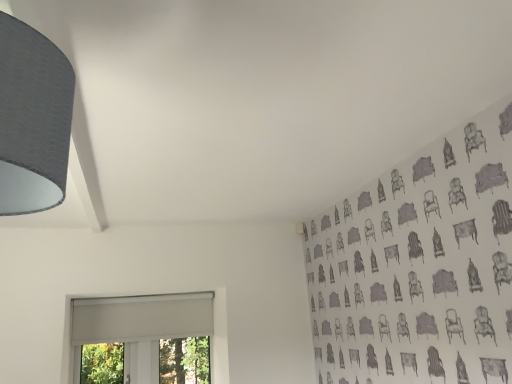
What do you see at coordinates (139, 325) in the screenshot? I see `white matte window at lower left` at bounding box center [139, 325].

You are a GUI agent. You are given a task and a screenshot of the screen. Output one action in this format:
    pyautogui.click(x=<x>, y=<y>)
    Task: Click on the white matte window at lower left
    
    Given the screenshot: What is the action you would take?
    pyautogui.click(x=139, y=325)

Measure the distance between white matte window at lower left and camera.

They are 2.87 meters apart.

This screenshot has width=512, height=384. I want to click on matte gray lampshade at upper left, so click(33, 119).

The height and width of the screenshot is (384, 512). What do you see at coordinates (33, 119) in the screenshot?
I see `matte gray lampshade at upper left` at bounding box center [33, 119].

Locate an element on the screen. The width and height of the screenshot is (512, 384). white matte window at lower left is located at coordinates (139, 325).

Is white matte window at lower left to the right of matte gray lampshade at upper left from the viewer's perspective?

In fact, white matte window at lower left is to the left of matte gray lampshade at upper left.

In the scene shown: Is white matte window at lower left positioned in front of matte gray lampshade at upper left?

No, it is not.

Between point (151, 374) and point (36, 136), which one is positioned behind?

The point (151, 374) is behind.

Looking at this image, from the image's perspective, which one is positioned lower, white matte window at lower left or matte gray lampshade at upper left?

From the image's view, white matte window at lower left is below.

From a real-world perspective, is white matte window at lower left located beneath matte gray lampshade at upper left?

Yes, from a real-world perspective, white matte window at lower left is below matte gray lampshade at upper left.

Does white matte window at lower left have a lesser width compared to matte gray lampshade at upper left?

Yes, white matte window at lower left is thinner than matte gray lampshade at upper left.

Considering the sizes of objects white matte window at lower left and matte gray lampshade at upper left in the image provided, who is shorter, white matte window at lower left or matte gray lampshade at upper left?

matte gray lampshade at upper left is shorter.

Considering the relative sizes of white matte window at lower left and matte gray lampshade at upper left in the image provided, is white matte window at lower left smaller than matte gray lampshade at upper left?

Actually, white matte window at lower left might be larger than matte gray lampshade at upper left.

Is white matte window at lower left situated inside matte gray lampshade at upper left or outside?

white matte window at lower left exists outside the volume of matte gray lampshade at upper left.

Are white matte window at lower left and matte gray lampshade at upper left far apart?

Yes.

Is white matte window at lower left looking in the opposite direction of matte gray lampshade at upper left?

white matte window at lower left does not have its back to matte gray lampshade at upper left.

In the scene shown: What's the angular difference between white matte window at lower left and matte gray lampshade at upper left's facing directions?

2.21 degrees.

What are the coordinates of `lamp in front of the white matte window at lower left` in the screenshot? It's located at (33, 119).

Which object is positioned more to the left, matte gray lampshade at upper left or white matte window at lower left?

From the viewer's perspective, white matte window at lower left appears more on the left side.

Relative to white matte window at lower left, is matte gray lampshade at upper left in front or behind?

Visually, matte gray lampshade at upper left is located in front of white matte window at lower left.

Considering the points (3, 174) and (191, 332), which point is behind, point (3, 174) or point (191, 332)?

Positioned behind is point (191, 332).

From the image's perspective, who appears lower, matte gray lampshade at upper left or white matte window at lower left?

From the image's view, white matte window at lower left is below.

From a real-world perspective, who is located lower, matte gray lampshade at upper left or white matte window at lower left?

white matte window at lower left is physically lower.

Is matte gray lampshade at upper left thinner than white matte window at lower left?

Incorrect, the width of matte gray lampshade at upper left is not less than that of white matte window at lower left.

Which of these two, matte gray lampshade at upper left or white matte window at lower left, stands shorter?

With less height is matte gray lampshade at upper left.

Is matte gray lampshade at upper left bigger than white matte window at lower left?

No, matte gray lampshade at upper left is not bigger than white matte window at lower left.

Is matte gray lampshade at upper left not inside white matte window at lower left?

That's correct, matte gray lampshade at upper left is outside of white matte window at lower left.

Would you say matte gray lampshade at upper left is a long distance from white matte window at lower left?

Yes, matte gray lampshade at upper left and white matte window at lower left are quite far apart.

Is matte gray lampshade at upper left positioned with its back to white matte window at lower left?

Yes, matte gray lampshade at upper left's orientation is away from white matte window at lower left.

How far apart are matte gray lampshade at upper left and white matte window at lower left?

A distance of 8.33 feet exists between matte gray lampshade at upper left and white matte window at lower left.

At what (x,y) coordinates should I click in order to perform the action: click on window that is behind the matte gray lampshade at upper left. Please return your answer as a coordinate pair (x, y). The height and width of the screenshot is (384, 512). Looking at the image, I should click on (139, 325).

You are a GUI agent. You are given a task and a screenshot of the screen. Output one action in this format:
    pyautogui.click(x=<x>, y=<y>)
    Task: Click on the lamp located above the white matte window at lower left (from the image's perspective)
    The height and width of the screenshot is (384, 512).
    Given the screenshot: What is the action you would take?
    click(x=33, y=119)

The width and height of the screenshot is (512, 384). I want to click on lamp above the white matte window at lower left (from a real-world perspective), so click(33, 119).